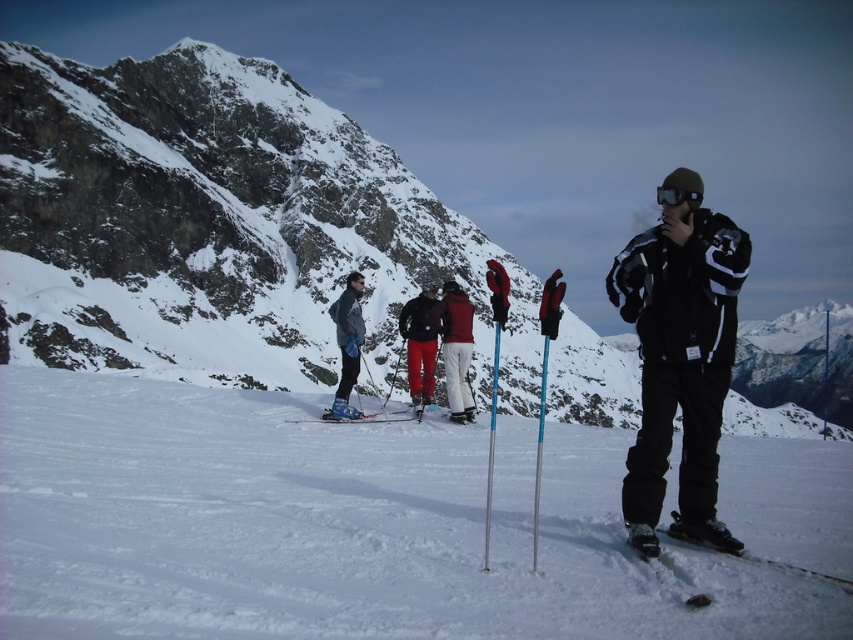
You are standing at the point with coordinates point [96,248] and want to move towards point [422,301]. Based on the scene, will you be moving forward or backward?

Since point [96,248] is closer to you than point [422,301], moving towards point [422,301] would mean moving forward in the scene.

From the picture: You are a photographer trying to capture a clear shot of the black matte goggles at center. However, the white powder snow at center is in your way. Can you adjust your position to avoid the snow and still see the goggles?

The white powder snow at center is closer to the viewer than the black matte goggles at center, so you cannot adjust your position to avoid the snow while still seeing the goggles. The snow will block the view of the goggles.

You are standing at the base of the mountain and want to reach the point that is closer to you. Which point should you head towards, point (572, 461) or point (693, 198)?

Point (572, 461) is closer to you because it is further to the viewer than point (693, 198).